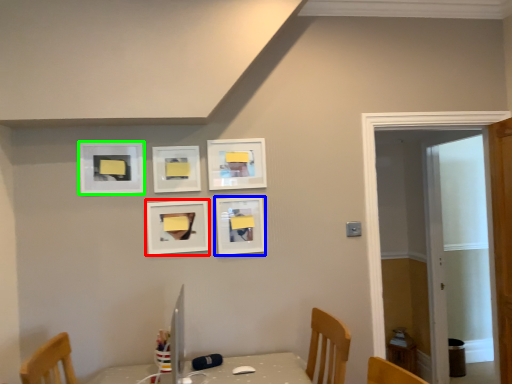
Question: Which object is positioned closest to picture frame (highlighted by a red box)? Select from picture frame (highlighted by a blue box) and picture frame (highlighted by a green box).

Choices:
 (A) picture frame
 (B) picture frame

Answer: (A)